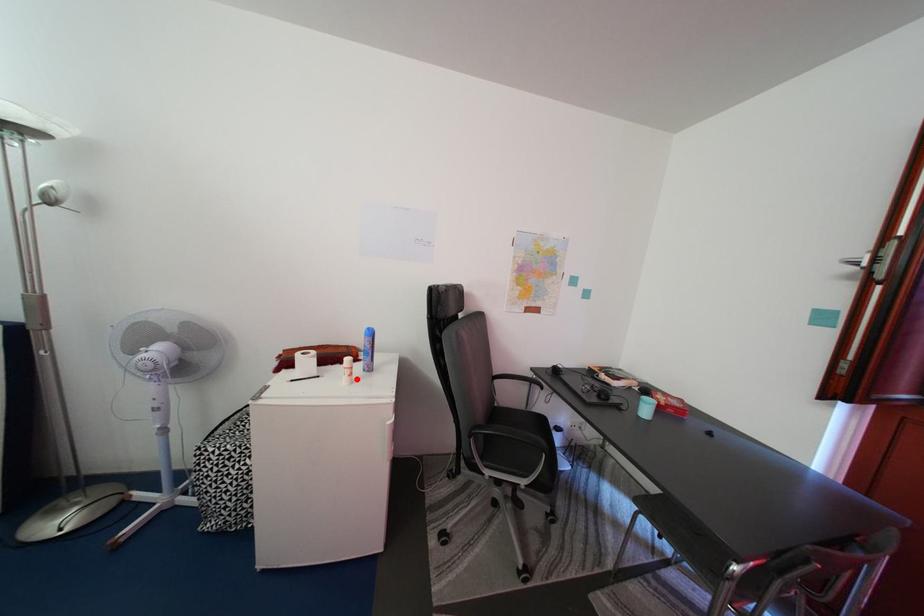
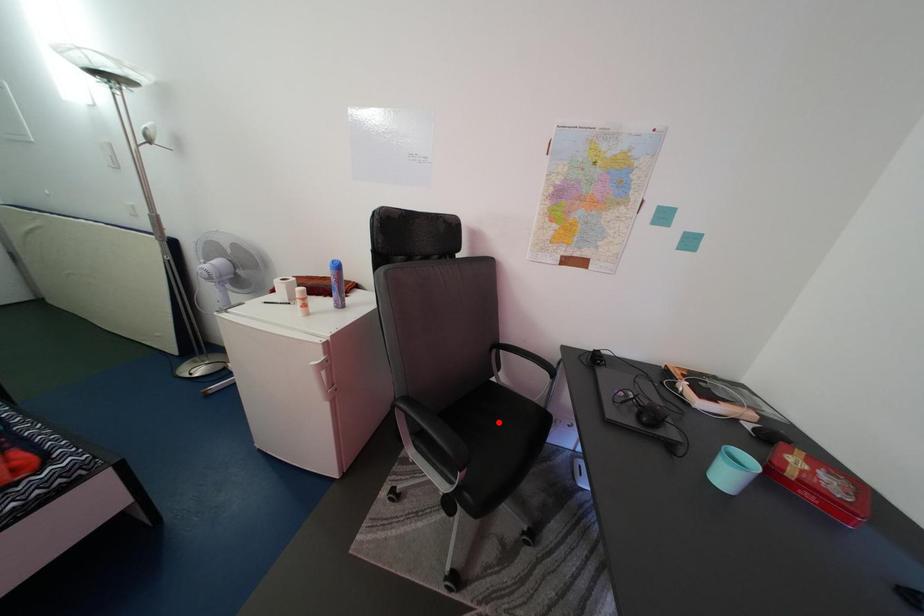
I am providing you with two images of the same scene from different viewpoints. A red point is marked on the first image and another point is marked on the second image. Are the points marked in image1 and image2 representing the same 3D position?

No